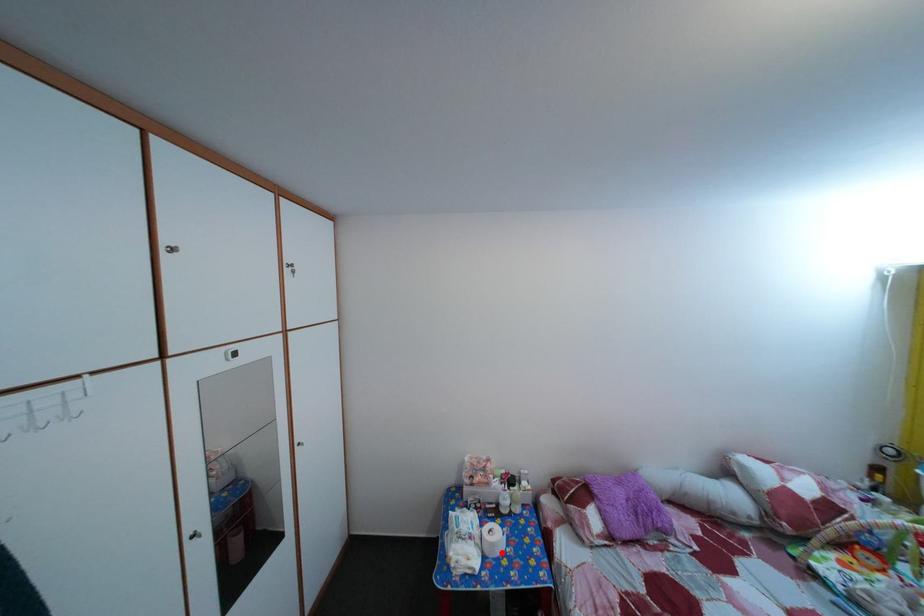
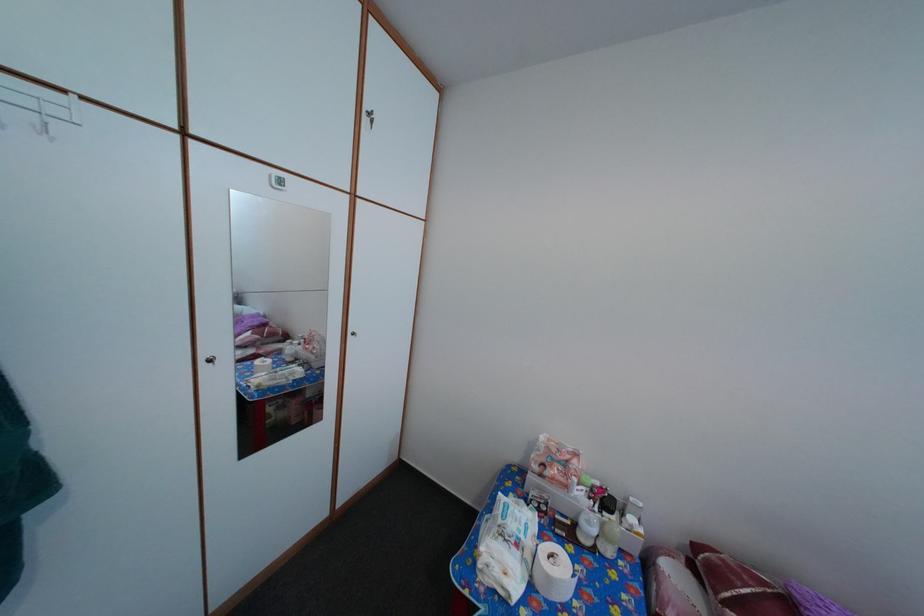
Locate, in the second image, the point that corresponds to the highlighted location in the first image.

(558, 586)